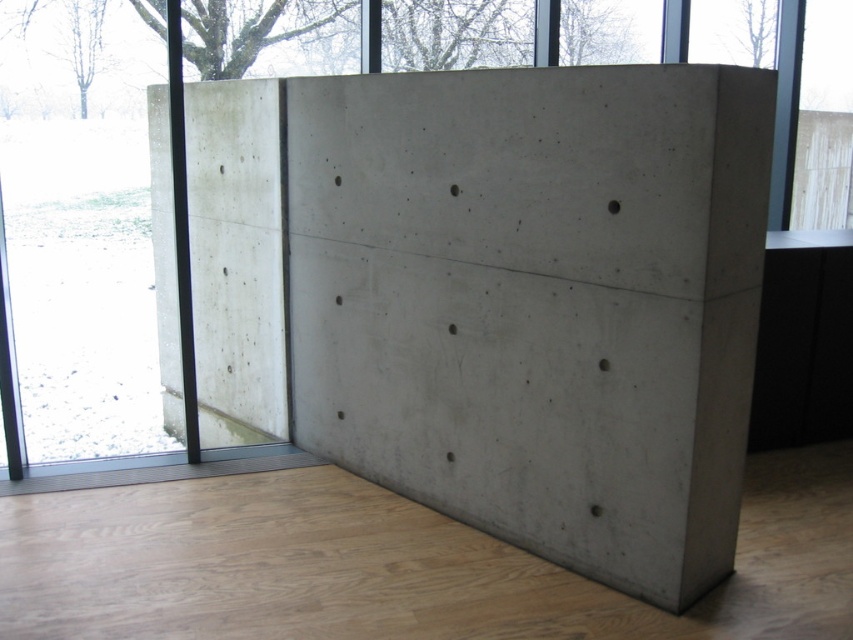
You are an interior designer planning to place a large sofa in this room. The sofa is 2 meters wide. You need to ensure there is enough space between the gray concrete wall at center and the transparent glass door at left to accommodate the sofa. Can the sofa fit in the space between them?

The gray concrete wall at center is wider than the transparent glass door at left. However, the description only provides information about their widths relative to each other, not the exact dimensions of the space between them. Without knowing the actual distance between the two objects, it is impossible to determine if the 2m wide sofa will fit.